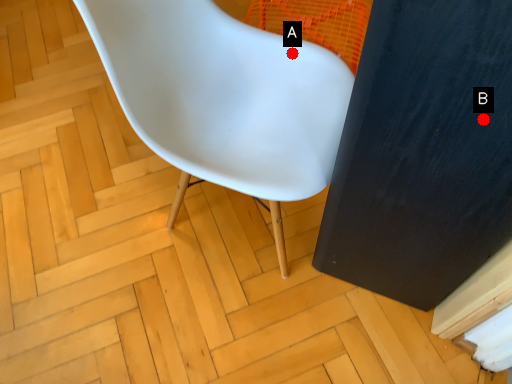
Question: Two points are circled on the image, labeled by A and B beside each circle. Which of the following is the farthest from the observer?

Choices:
 (A) A is further
 (B) B is further

Answer: (A)